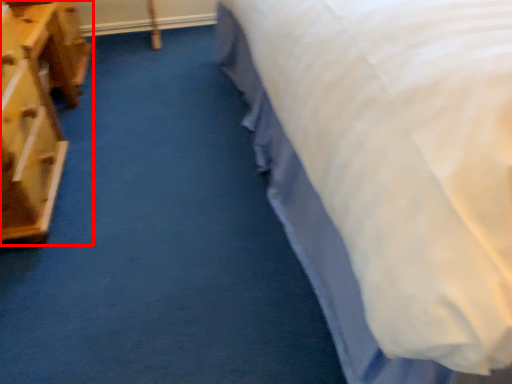
Question: From the image, what is the correct spatial relationship of furniture (annotated by the red box) in relation to bed?

Choices:
 (A) right
 (B) left

Answer: (B)